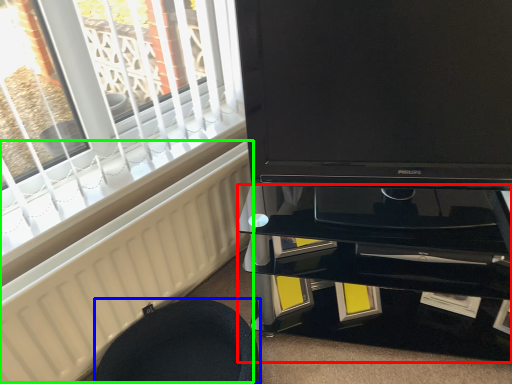
Question: Which object is the farthest from tv cabinet (highlighted by a red box)? Choose among these: furniture (highlighted by a blue box) or radiator (highlighted by a green box).

Choices:
 (A) furniture
 (B) radiator

Answer: (B)